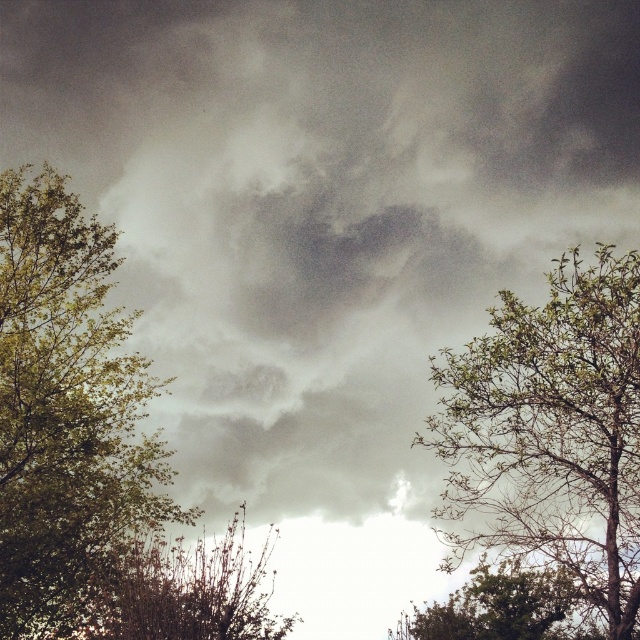
Question: Among these points, which one is nearest to the camera?

Choices:
 (A) (195, 637)
 (B) (61, 198)
 (C) (576, 509)
 (D) (522, 604)

Answer: (A)

Question: Can you confirm if green leafy tree at left is smaller than green leafy tree at lower right?

Choices:
 (A) yes
 (B) no

Answer: (A)

Question: Is green leafy tree at left bigger than brown textured bush at lower left?

Choices:
 (A) no
 (B) yes

Answer: (A)

Question: Does green leafy tree at left appear over brown textured bush at lower left?

Choices:
 (A) yes
 (B) no

Answer: (B)

Question: Which object is the closest to the brown textured bush at lower left?

Choices:
 (A) green leafy tree at right
 (B) green leafy tree at lower right

Answer: (B)

Question: Which point appears closest to the camera in this image?

Choices:
 (A) (632, 387)
 (B) (115, 257)
 (C) (179, 566)
 (D) (500, 577)

Answer: (A)